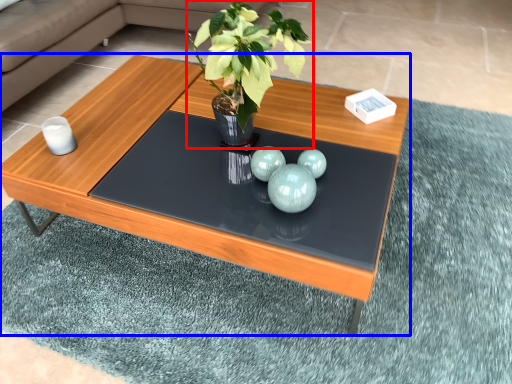
Question: Which of the following is the closest to the observer, houseplant (highlighted by a red box) or coffee table (highlighted by a blue box)?

Choices:
 (A) houseplant
 (B) coffee table

Answer: (A)